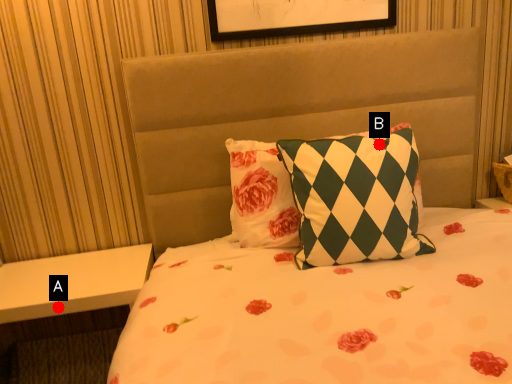
Question: Two points are circled on the image, labeled by A and B beside each circle. Which of the following is the farthest from the observer?

Choices:
 (A) A is further
 (B) B is further

Answer: (A)